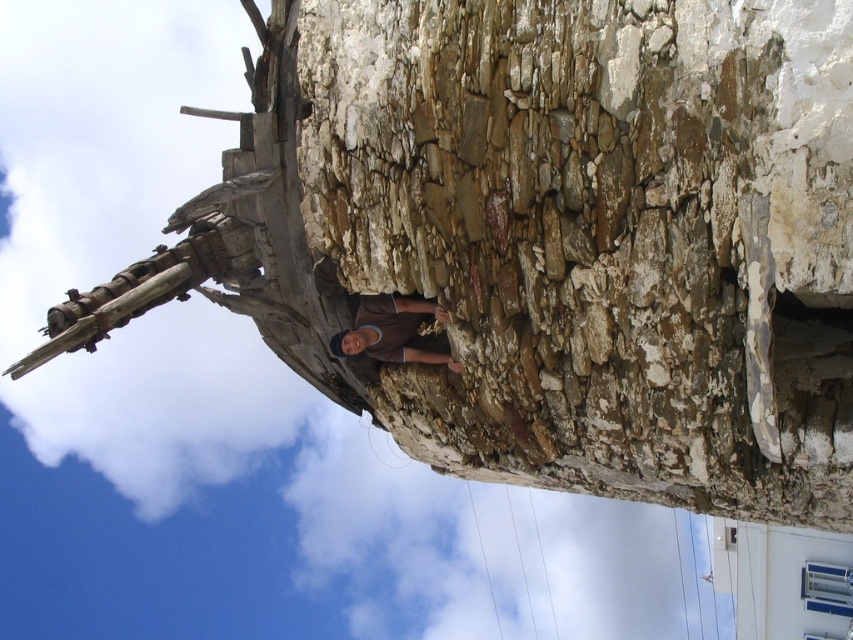
Question: Considering the relative positions of rusty stone wall at center and brown matte shirt at center in the image provided, where is rusty stone wall at center located with respect to brown matte shirt at center?

Choices:
 (A) left
 (B) right

Answer: (B)

Question: Which of the following is the farthest from the observer?

Choices:
 (A) (386, 385)
 (B) (381, 307)

Answer: (A)

Question: Is rusty stone wall at center bigger than brown matte shirt at center?

Choices:
 (A) no
 (B) yes

Answer: (B)

Question: Which object is farther from the camera taking this photo?

Choices:
 (A) rusty stone wall at center
 (B) brown matte shirt at center

Answer: (B)

Question: Does rusty stone wall at center have a smaller size compared to brown matte shirt at center?

Choices:
 (A) no
 (B) yes

Answer: (A)